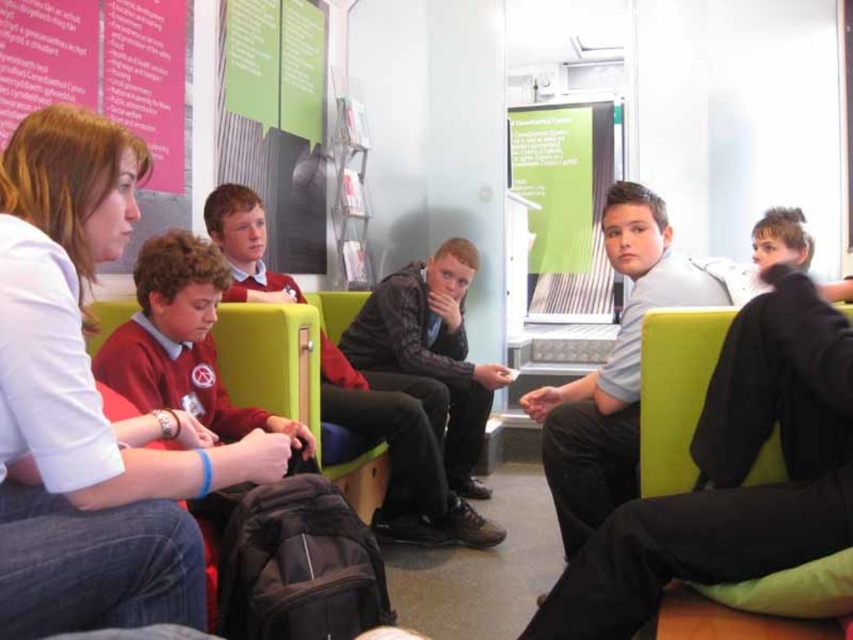
What do you see at coordinates (88, 404) in the screenshot? I see `red sweater at left` at bounding box center [88, 404].

Is point (128, 564) farther from camera compared to point (573, 492)?

No, it is in front of (573, 492).

Which is behind, point (53, 593) or point (630, 440)?

The point (630, 440) is behind.

The width and height of the screenshot is (853, 640). I want to click on red sweater at left, so click(x=88, y=404).

Between point (682, 280) and point (456, 396), which one is positioned in front?

Positioned in front is point (682, 280).

Is light gray shirt at center positioned behind dark gray jacket at center?

No, it is not.

This screenshot has height=640, width=853. Identify the location of light gray shirt at center. (614, 369).

Does point (125, 198) come in front of point (476, 493)?

Yes, it is in front of point (476, 493).

Is point (9, 179) positioned after point (426, 304)?

No, it is in front of (426, 304).

Find the location of a particular element. This screenshot has height=640, width=853. red sweater at left is located at coordinates (88, 404).